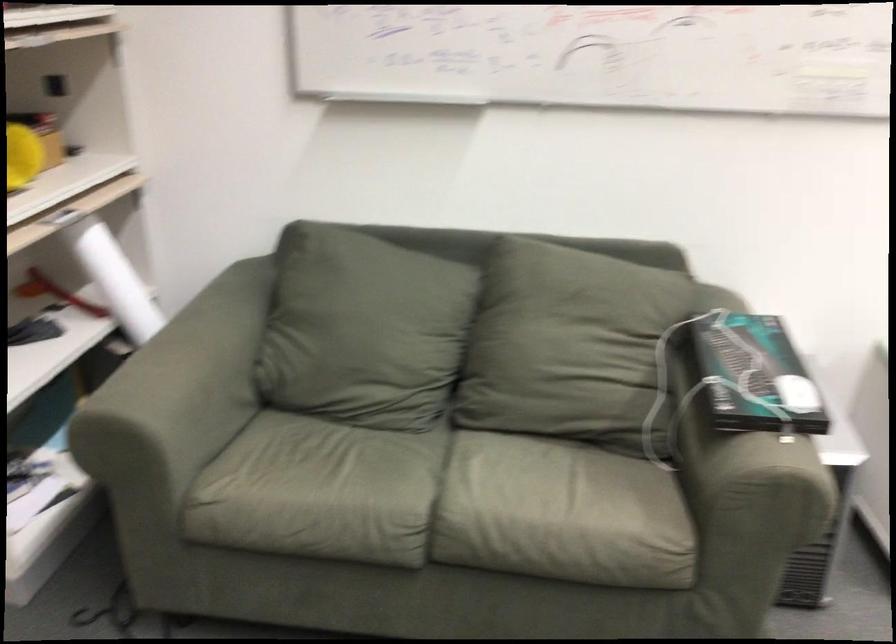
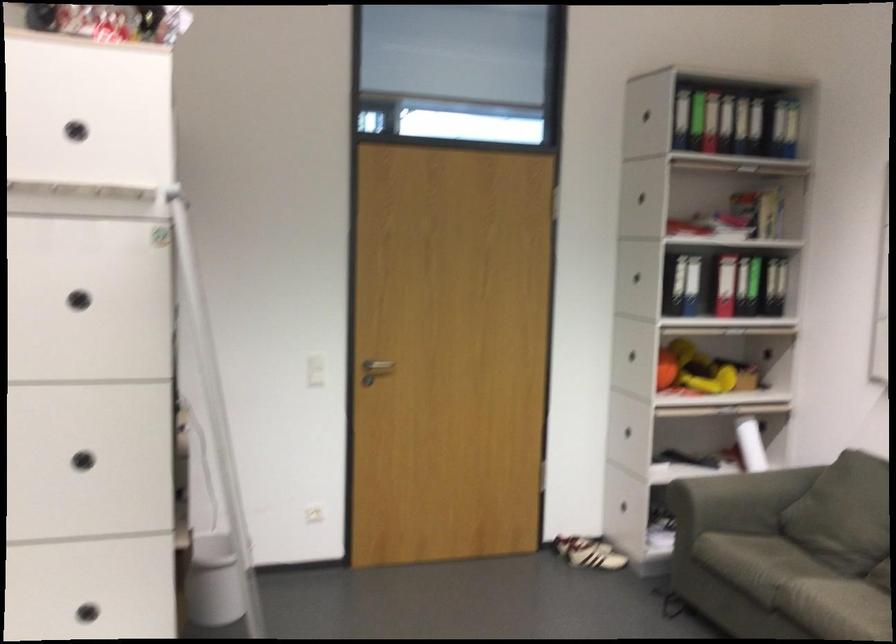
The point at [492,471] is marked in the first image. Where is the corresponding point in the second image?

(832, 592)